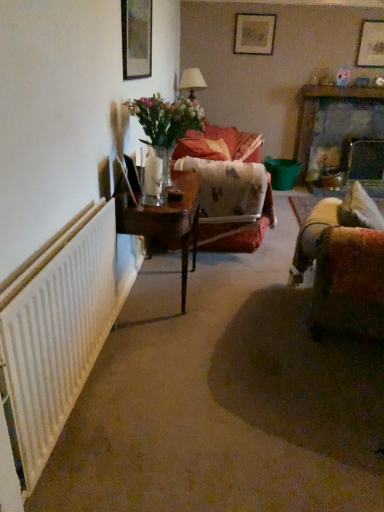
The image size is (384, 512). What do you see at coordinates (344, 264) in the screenshot?
I see `velvet brown couch at right` at bounding box center [344, 264].

Identify the location of wooden picture frame at upper left, acting as the first picture frame starting from the bottom. (136, 38).

What do you see at coordinates (254, 34) in the screenshot?
I see `matte wooden picture frame at upper center, acting as the first picture frame starting from the back` at bounding box center [254, 34].

In order to face wooden table at center, should I rotate leftwards or rightwards?

Turn left by 3.560 degrees to look at wooden table at center.

Describe the element at coordinates (219, 144) in the screenshot. The width and height of the screenshot is (384, 512). I see `velvet floral couch at center` at that location.

Find the location of a particular element. This screenshot has height=512, width=384. velvet floral couch at center is located at coordinates (219, 144).

In order to click on wooden picture frame at upper right, positioned as the 2th picture frame in top-to-bottom order in this screenshot , I will do `click(371, 44)`.

What's the angular difference between clear glass vase at center and wooden picture frame at upper left, which is counted as the third picture frame, starting from the top,'s facing directions?

clear glass vase at center and wooden picture frame at upper left, which is counted as the third picture frame, starting from the top, are facing 0.00406 degrees away from each other.

Does point (179, 102) come behind point (123, 22)?

Yes, point (179, 102) is farther from viewer.

From the image's perspective, is clear glass vase at center located beneath wooden picture frame at upper left, positioned as the first picture frame in front-to-back order?

Yes, from the image's perspective, clear glass vase at center is beneath wooden picture frame at upper left, positioned as the first picture frame in front-to-back order.

Is clear glass vase at center completely or partially outside of wooden picture frame at upper left, acting as the first picture frame starting from the bottom?

Yes.

From a real-world perspective, is wooden table at center positioned over velvet brown couch at right based on gravity?

No, from a real-world perspective, wooden table at center is not over velvet brown couch at right

Could you tell me if wooden table at center is turned towards velvet brown couch at right?

Yes, wooden table at center is facing velvet brown couch at right.

Are wooden table at center and velvet brown couch at right making contact?

No, wooden table at center is not making contact with velvet brown couch at right.

Is wooden table at center situated inside velvet brown couch at right or outside?

The correct answer is: outside.

From the image's perspective, is wooden picture frame at upper left, the 3th picture frame positioned from the right, beneath clear glass vase at center?

No.

Does wooden picture frame at upper left, acting as the first picture frame starting from the bottom, appear on the left side of clear glass vase at center?

Correct, you'll find wooden picture frame at upper left, acting as the first picture frame starting from the bottom, to the left of clear glass vase at center.

Is wooden picture frame at upper left, the 3th picture frame positioned from the right, shorter than clear glass vase at center?

No.

Is wooden picture frame at upper left, acting as the first picture frame starting from the bottom, not near clear glass vase at center?

wooden picture frame at upper left, acting as the first picture frame starting from the bottom, is near clear glass vase at center, not far away.

Between point (204, 136) and point (138, 102), which one is positioned behind?

The point (204, 136) is behind.

Between velvet floral couch at center and clear glass vase at center, which one has larger size?

With larger size is velvet floral couch at center.

From a real-world perspective, is velvet floral couch at center located higher than clear glass vase at center?

No.

Could clear glass vase at center be considered to be inside velvet floral couch at center?

No, clear glass vase at center is located outside of velvet floral couch at center.

Does wooden table at center contain matte wooden picture frame at upper center, the 2th picture frame from the left?

No, matte wooden picture frame at upper center, the 2th picture frame from the left, is not a part of wooden table at center.

From the image's perspective, between wooden table at center and matte wooden picture frame at upper center, positioned as the 3th picture frame in front-to-back order, which one is located above?

matte wooden picture frame at upper center, positioned as the 3th picture frame in front-to-back order, from the image's perspective.

Does wooden table at center have a smaller size compared to matte wooden picture frame at upper center, the 3th picture frame positioned from the bottom?

Incorrect, wooden table at center is not smaller in size than matte wooden picture frame at upper center, the 3th picture frame positioned from the bottom.

Is wooden picture frame at upper left, acting as the first picture frame starting from the bottom, completely or partially outside of white textured radiator at left?

Indeed, wooden picture frame at upper left, acting as the first picture frame starting from the bottom, is completely outside white textured radiator at left.

Looking at their sizes, would you say wooden picture frame at upper left, acting as the first picture frame starting from the bottom, is wider or thinner than white textured radiator at left?

wooden picture frame at upper left, acting as the first picture frame starting from the bottom, is thinner than white textured radiator at left.

Considering the relative sizes of wooden picture frame at upper left, acting as the first picture frame starting from the bottom, and white textured radiator at left in the image provided, is wooden picture frame at upper left, acting as the first picture frame starting from the bottom, smaller than white textured radiator at left?

Yes.

This screenshot has width=384, height=512. In order to click on couch behind the clear glass vase at center in this screenshot , I will do `click(219, 144)`.

Is clear glass vase at center next to velvet floral couch at center and touching it?

No, clear glass vase at center is not next to velvet floral couch at center.

Considering the sizes of objects clear glass vase at center and velvet floral couch at center in the image provided, who is wider, clear glass vase at center or velvet floral couch at center?

With larger width is velvet floral couch at center.

I want to click on the 1st picture frame located above the clear glass vase at center (from a real-world perspective), so click(x=136, y=38).

Image resolution: width=384 pixels, height=512 pixels. Identify the location of studio couch that appears below the wooden table at center (from the image's perspective). (344, 264).

Based on their spatial positions, is white textured radiator at left or wooden picture frame at upper left, positioned as the first picture frame in front-to-back order, closer to clear glass vase at center?

Among the two, wooden picture frame at upper left, positioned as the first picture frame in front-to-back order, is located nearer to clear glass vase at center.

Estimate the real-world distances between objects in this image. Which object is further from velvet floral couch at center, white textured radiator at left or velvet brown couch at right?

Based on the image, white textured radiator at left appears to be further to velvet floral couch at center.

Looking at the image, which one is located further to wooden picture frame at upper left, positioned as the first picture frame in front-to-back order, wooden table at center or clear glass vase at center?

Based on the image, wooden table at center appears to be further to wooden picture frame at upper left, positioned as the first picture frame in front-to-back order.

When comparing their distances from matte wooden picture frame at upper center, positioned as the 3th picture frame in front-to-back order, does white textured radiator at left or wooden table at center seem further?

white textured radiator at left.

Estimate the real-world distances between objects in this image. Which object is further from matte wooden picture frame at upper center, the second picture frame in the right-to-left sequence, wooden table at center or wooden picture frame at upper left, which is counted as the third picture frame, starting from the top?

wooden table at center is further to matte wooden picture frame at upper center, the second picture frame in the right-to-left sequence.

Based on their spatial positions, is matte wooden picture frame at upper center, the 3th picture frame positioned from the bottom, or velvet brown couch at right closer to wooden table at center?

The object closer to wooden table at center is velvet brown couch at right.

Considering their positions, is wooden table at center positioned closer to matte wooden picture frame at upper center, positioned as the 3th picture frame in front-to-back order, than white textured radiator at left?

wooden table at center.

Which object lies nearer to the anchor point velvet brown couch at right, wooden picture frame at upper left, positioned as the third picture frame in back-to-front order, or matte wooden picture frame at upper center, the first picture frame when ordered from top to bottom?

wooden picture frame at upper left, positioned as the third picture frame in back-to-front order.

Where is `couch positioned between clear glass vase at center and matte wooden picture frame at upper center, the 2th picture frame from the left, from near to far`? The height and width of the screenshot is (512, 384). couch positioned between clear glass vase at center and matte wooden picture frame at upper center, the 2th picture frame from the left, from near to far is located at coordinates (219, 144).

Where is `table between white textured radiator at left and clear glass vase at center from front to back`? table between white textured radiator at left and clear glass vase at center from front to back is located at coordinates (165, 220).

Where is `couch between white textured radiator at left and matte wooden picture frame at upper center, positioned as the 3th picture frame in front-to-back order, from front to back`? couch between white textured radiator at left and matte wooden picture frame at upper center, positioned as the 3th picture frame in front-to-back order, from front to back is located at coordinates (219, 144).

Image resolution: width=384 pixels, height=512 pixels. In order to click on couch positioned between velvet brown couch at right and wooden picture frame at upper right, the second picture frame positioned from the back, from near to far in this screenshot , I will do `click(219, 144)`.